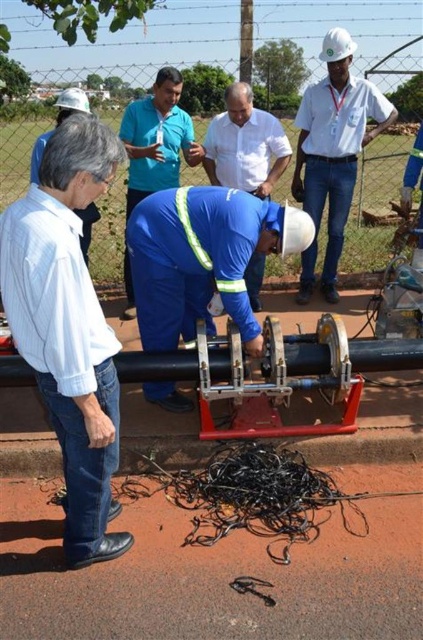
Question: Can you confirm if blue reflective safety vest at center is bigger than white hard hat at upper left?

Choices:
 (A) yes
 (B) no

Answer: (B)

Question: Among these points, which one is nearest to the camera?

Choices:
 (A) (250, 346)
 (B) (76, 118)

Answer: (B)

Question: Which point appears closest to the camera in this image?

Choices:
 (A) (82, 104)
 (B) (7, 301)
 (C) (159, 113)

Answer: (B)

Question: Which of the following is the farthest from the observer?

Choices:
 (A) white shirt at left
 (B) white hard hat at upper left
 (C) blue reflective safety vest at center

Answer: (C)

Question: Considering the relative positions of white shirt at left and white hard hat at center in the image provided, where is white shirt at left located with respect to white hard hat at center?

Choices:
 (A) right
 (B) left

Answer: (B)

Question: Can you confirm if white shirt at left is positioned above white hard hat at center?

Choices:
 (A) yes
 (B) no

Answer: (B)